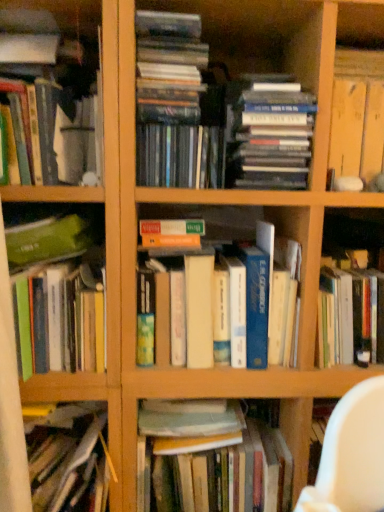
At what (x,y) coordinates should I click in order to perform the action: click on hardcover book at upper center, which is the ninth book from bottom to top. Please return your answer as a coordinate pair (x, y). Looking at the image, I should click on (269, 133).

Describe the element at coordinates (223, 297) in the screenshot. Image resolution: width=384 pixels, height=512 pixels. I see `hardcover books at center, which is the fourth book in bottom-to-top order` at that location.

The width and height of the screenshot is (384, 512). Find the location of `hardcover books at center, marked as the sixth book in a bottom-to-top arrangement`. hardcover books at center, marked as the sixth book in a bottom-to-top arrangement is located at coordinates (180, 156).

What do you see at coordinates (357, 114) in the screenshot? The height and width of the screenshot is (512, 384). I see `hardcover book at upper right, the eighth book positioned from the bottom` at bounding box center [357, 114].

I want to click on hardcover book at upper center, the 2th book viewed from the top, so click(269, 133).

Is hardcover book at upper right, the eighth book positioned from the bottom, inside or outside of hardcover book at lower left, marked as the ninth book in a top-to-bottom arrangement?

hardcover book at upper right, the eighth book positioned from the bottom, is not inside hardcover book at lower left, marked as the ninth book in a top-to-bottom arrangement, it's outside.

Is hardcover book at upper right, the eighth book positioned from the bottom, next to hardcover book at lower left, arranged as the second book when ordered from the bottom, and touching it?

There is a gap between hardcover book at upper right, the eighth book positioned from the bottom, and hardcover book at lower left, arranged as the second book when ordered from the bottom.

Considering the relative sizes of hardcover book at upper right, the eighth book positioned from the bottom, and hardcover book at lower left, marked as the ninth book in a top-to-bottom arrangement, in the image provided, is hardcover book at upper right, the eighth book positioned from the bottom, wider than hardcover book at lower left, marked as the ninth book in a top-to-bottom arrangement,?

Incorrect, the width of hardcover book at upper right, the eighth book positioned from the bottom, does not surpass that of hardcover book at lower left, marked as the ninth book in a top-to-bottom arrangement.

Which of these two, hardcover book at upper right, the third book from the top, or hardcover book at lower left, marked as the ninth book in a top-to-bottom arrangement, is smaller?

hardcover book at upper right, the third book from the top.

From a real-world perspective, is hardcover books at center, marked as the sixth book in a bottom-to-top arrangement, positioned above or below hardcover book at lower left, arranged as the second book when ordered from the bottom?

hardcover books at center, marked as the sixth book in a bottom-to-top arrangement, is situated higher than hardcover book at lower left, arranged as the second book when ordered from the bottom, in the real world.

Considering their positions, is hardcover books at center, marked as the sixth book in a bottom-to-top arrangement, located in front of or behind hardcover book at lower left, marked as the ninth book in a top-to-bottom arrangement?

hardcover books at center, marked as the sixth book in a bottom-to-top arrangement, is positioned closer to the viewer than hardcover book at lower left, marked as the ninth book in a top-to-bottom arrangement.

Is hardcover books at center, arranged as the fifth book when viewed from the top, not within hardcover book at lower left, marked as the ninth book in a top-to-bottom arrangement?

Yes, hardcover books at center, arranged as the fifth book when viewed from the top, is not within hardcover book at lower left, marked as the ninth book in a top-to-bottom arrangement.

Could you tell me if hardcover books at center, marked as the sixth book in a bottom-to-top arrangement, is facing hardcover book at lower left, marked as the ninth book in a top-to-bottom arrangement?

No, hardcover books at center, marked as the sixth book in a bottom-to-top arrangement, is not facing towards hardcover book at lower left, marked as the ninth book in a top-to-bottom arrangement.

Who is bigger, green matte book at left, arranged as the sixth book when viewed from the top, or hardcover book at lower left, marked as the ninth book in a top-to-bottom arrangement?

hardcover book at lower left, marked as the ninth book in a top-to-bottom arrangement, is bigger.

Is green matte book at left, arranged as the sixth book when viewed from the top, aimed at hardcover book at lower left, arranged as the second book when ordered from the bottom?

No, green matte book at left, arranged as the sixth book when viewed from the top, does not turn towards hardcover book at lower left, arranged as the second book when ordered from the bottom.

From a real-world perspective, which is physically below, green matte book at left, arranged as the sixth book when viewed from the top, or hardcover book at lower left, marked as the ninth book in a top-to-bottom arrangement?

hardcover book at lower left, marked as the ninth book in a top-to-bottom arrangement.

Who is taller, hardcover books at center, which is the fourth book in bottom-to-top order, or hardcover books at center, arranged as the fifth book when viewed from the top?

hardcover books at center, which is the fourth book in bottom-to-top order.

Does point (230, 286) appear closer or farther from the camera than point (151, 135)?

Point (230, 286) appears to be farther away from the viewer than point (151, 135).

Can you confirm if hardcover books at center, which is the fourth book in bottom-to-top order, is wider than hardcover books at center, arranged as the fifth book when viewed from the top?

Incorrect, the width of hardcover books at center, which is the fourth book in bottom-to-top order, does not surpass that of hardcover books at center, arranged as the fifth book when viewed from the top.

Who is smaller, hardcover book at lower left, arranged as the second book when ordered from the bottom, or hardcover book at bottom center, which is counted as the 10th book, starting from the top?

hardcover book at bottom center, which is counted as the 10th book, starting from the top.

From the image's perspective, relative to hardcover book at bottom center, which is counted as the 10th book, starting from the top, is hardcover book at lower left, arranged as the second book when ordered from the bottom, above or below?

hardcover book at lower left, arranged as the second book when ordered from the bottom, is above hardcover book at bottom center, which is counted as the 10th book, starting from the top.

From the hardcover book at lower left, marked as the ninth book in a top-to-bottom arrangement, count 5th book to the right and point to it. Please provide its 2D coordinates.

[(212, 463)]

Is hardcover book at lower left, marked as the ninth book in a top-to-bottom arrangement, further to the viewer compared to hardcover book at bottom center, which is counted as the 10th book, starting from the top?

No, hardcover book at lower left, marked as the ninth book in a top-to-bottom arrangement, is closer to the camera.

Which of these two, hardcover book at bottom center, placed as the 1th book when sorted from bottom to top, or matte white vase at upper left, the 7th book when ordered from bottom to top, is smaller?

Smaller between the two is matte white vase at upper left, the 7th book when ordered from bottom to top.

Looking at this image, from a real-world perspective, is hardcover book at bottom center, placed as the 1th book when sorted from bottom to top, over matte white vase at upper left, the fourth book from the top?

No, from a real-world perspective, hardcover book at bottom center, placed as the 1th book when sorted from bottom to top, is not on top of matte white vase at upper left, the fourth book from the top.

Does point (194, 461) come in front of point (74, 51)?

No.

From the image's perspective, is hardcover book at bottom center, placed as the 1th book when sorted from bottom to top, positioned above or below matte white vase at upper left, the 7th book when ordered from bottom to top?

From the image's perspective, hardcover book at bottom center, placed as the 1th book when sorted from bottom to top, appears below matte white vase at upper left, the 7th book when ordered from bottom to top.

Which object is positioned more to the left, matte white vase at upper left, the 7th book when ordered from bottom to top, or hardcover book at lower left, arranged as the second book when ordered from the bottom?

matte white vase at upper left, the 7th book when ordered from bottom to top, is more to the left.

Does point (13, 32) come farther from viewer compared to point (97, 436)?

No, it is not.

Based on their sizes in the image, would you say matte white vase at upper left, the 7th book when ordered from bottom to top, is bigger or smaller than hardcover book at lower left, marked as the ninth book in a top-to-bottom arrangement?

matte white vase at upper left, the 7th book when ordered from bottom to top, is smaller than hardcover book at lower left, marked as the ninth book in a top-to-bottom arrangement.

Considering the sizes of objects matte white vase at upper left, the 7th book when ordered from bottom to top, and hardcover book at lower left, arranged as the second book when ordered from the bottom, in the image provided, who is shorter, matte white vase at upper left, the 7th book when ordered from bottom to top, or hardcover book at lower left, arranged as the second book when ordered from the bottom,?

matte white vase at upper left, the 7th book when ordered from bottom to top.

In order to click on the 3rd book in front of the hardcover book at upper right, the eighth book positioned from the bottom in this screenshot , I will do `click(69, 459)`.

From the hardcover book at lower left, arranged as the second book when ordered from the bottom, count 4th book to the right and point to it. Please provide its 2D coordinates.

[(180, 156)]

Estimate the real-world distances between objects in this image. Which object is closer to hardcover book at bottom center, which is counted as the 10th book, starting from the top, hardcover book at upper center, which is the ninth book from bottom to top, or hardcover book at lower left, arranged as the second book when ordered from the bottom?

The object closer to hardcover book at bottom center, which is counted as the 10th book, starting from the top, is hardcover book at lower left, arranged as the second book when ordered from the bottom.

Estimate the real-world distances between objects in this image. Which object is further from green matte book at left, arranged as the sixth book when viewed from the top, hardcover books at center, the 7th book in the top-to-bottom sequence, or hardcover book at lower left, marked as the ninth book in a top-to-bottom arrangement?

hardcover book at lower left, marked as the ninth book in a top-to-bottom arrangement, is positioned further to the anchor green matte book at left, arranged as the sixth book when viewed from the top.

Which object lies further to the anchor point hardcover books at center, the 7th book in the top-to-bottom sequence, hardcover books at center, arranged as the tenth book when ordered from the bottom, or hardcover book at bottom center, which is counted as the 10th book, starting from the top?

hardcover book at bottom center, which is counted as the 10th book, starting from the top, is positioned further to the anchor hardcover books at center, the 7th book in the top-to-bottom sequence.

From the image, which object appears to be nearer to hardcover book at bottom center, which is counted as the 10th book, starting from the top, hardcover book at upper right, the third book from the top, or matte white vase at upper left, the fourth book from the top?

The object closer to hardcover book at bottom center, which is counted as the 10th book, starting from the top, is matte white vase at upper left, the fourth book from the top.

From the image, which object appears to be nearer to hardcover book at lower left, marked as the ninth book in a top-to-bottom arrangement, hardcover books at center, arranged as the fifth book when viewed from the top, or hardcover books at center, which is the fourth book in bottom-to-top order?

hardcover books at center, which is the fourth book in bottom-to-top order.

From the image, which object appears to be farther from green matte book at left, arranged as the sixth book when viewed from the top, hardcover books at center, arranged as the fifth book when viewed from the top, or hardcover book at upper center, which is the ninth book from bottom to top?

hardcover book at upper center, which is the ninth book from bottom to top, lies further to green matte book at left, arranged as the sixth book when viewed from the top, than the other object.

Considering their positions, is matte white vase at upper left, the 7th book when ordered from bottom to top, positioned closer to hardcover books at center, marked as the sixth book in a bottom-to-top arrangement, than hardcover book at upper center, the 2th book viewed from the top?

Based on the image, hardcover book at upper center, the 2th book viewed from the top, appears to be nearer to hardcover books at center, marked as the sixth book in a bottom-to-top arrangement.

Estimate the real-world distances between objects in this image. Which object is further from green matte book at left, arranged as the sixth book when viewed from the top, hardcover book at lower left, arranged as the second book when ordered from the bottom, or hardcover books at center, which is the fourth book in bottom-to-top order?

hardcover book at lower left, arranged as the second book when ordered from the bottom.

You are a GUI agent. You are given a task and a screenshot of the screen. Output one action in this format:
    pyautogui.click(x=<x>, y=<y>)
    Task: Click on the book between green matte book at left, the third book ordered from the bottom, and hardcover book at bottom center, which is counted as the 10th book, starting from the top, in the up-down direction
    This screenshot has width=384, height=512.
    Given the screenshot: What is the action you would take?
    pyautogui.click(x=69, y=459)

The width and height of the screenshot is (384, 512). Find the location of `book between hardcover books at center, which is the fourth book in bottom-to-top order, and hardcover book at lower left, arranged as the second book when ordered from the bottom, in the up-down direction`. book between hardcover books at center, which is the fourth book in bottom-to-top order, and hardcover book at lower left, arranged as the second book when ordered from the bottom, in the up-down direction is located at coordinates (57, 296).